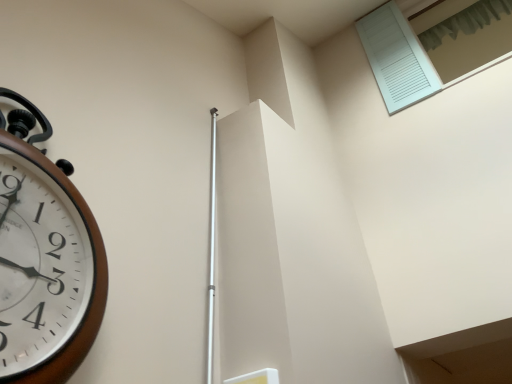
Question: Could you tell me if white textured shutter at upper right, the 1th window viewed from the top, is facing white matte shutter at upper right, the 2th window in the top-to-bottom sequence?

Choices:
 (A) yes
 (B) no

Answer: (A)

Question: From a real-world perspective, is white textured shutter at upper right, which ranks as the second window in bottom-to-top order, positioned under white matte shutter at upper right, the 1th window in the bottom-to-top sequence, based on gravity?

Choices:
 (A) yes
 (B) no

Answer: (B)

Question: Does white textured shutter at upper right, which ranks as the second window in bottom-to-top order, have a larger size compared to white matte shutter at upper right, the 1th window in the bottom-to-top sequence?

Choices:
 (A) no
 (B) yes

Answer: (A)

Question: From the image's perspective, is white textured shutter at upper right, which ranks as the second window in bottom-to-top order, below white matte shutter at upper right, the 2th window in the top-to-bottom sequence?

Choices:
 (A) no
 (B) yes

Answer: (A)

Question: Is white textured shutter at upper right, which ranks as the second window in bottom-to-top order, to the right of white matte shutter at upper right, the 1th window in the bottom-to-top sequence, from the viewer's perspective?

Choices:
 (A) yes
 (B) no

Answer: (A)

Question: Is white textured shutter at upper right, which ranks as the second window in bottom-to-top order, thinner than white matte shutter at upper right, the 1th window in the bottom-to-top sequence?

Choices:
 (A) no
 (B) yes

Answer: (B)

Question: From a real-world perspective, is white textured shutter at upper right, the 1th window viewed from the top, positioned over brown wooden wall clock at left based on gravity?

Choices:
 (A) yes
 (B) no

Answer: (A)

Question: Is white textured shutter at upper right, which ranks as the second window in bottom-to-top order, at the left side of brown wooden wall clock at left?

Choices:
 (A) yes
 (B) no

Answer: (B)

Question: Does white textured shutter at upper right, the 1th window viewed from the top, have a lesser width compared to brown wooden wall clock at left?

Choices:
 (A) yes
 (B) no

Answer: (B)

Question: Is white textured shutter at upper right, which ranks as the second window in bottom-to-top order, wider than brown wooden wall clock at left?

Choices:
 (A) no
 (B) yes

Answer: (B)

Question: From a real-world perspective, is white textured shutter at upper right, which ranks as the second window in bottom-to-top order, physically below brown wooden wall clock at left?

Choices:
 (A) no
 (B) yes

Answer: (A)

Question: Does white textured shutter at upper right, the 1th window viewed from the top, lie behind brown wooden wall clock at left?

Choices:
 (A) no
 (B) yes

Answer: (B)

Question: Does white matte shutter at upper right, the 2th window in the top-to-bottom sequence, touch brown wooden wall clock at left?

Choices:
 (A) yes
 (B) no

Answer: (B)